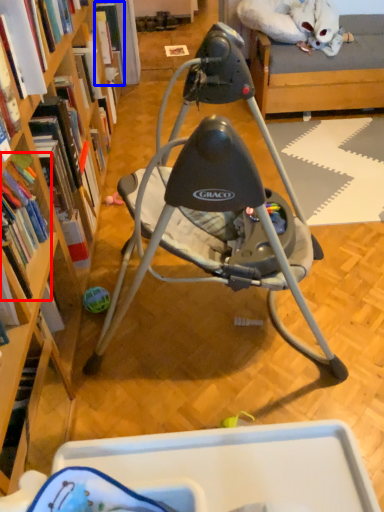
Question: Which point is closer to the camera, book (highlighted by a red box) or book (highlighted by a blue box)?

Choices:
 (A) book
 (B) book

Answer: (A)